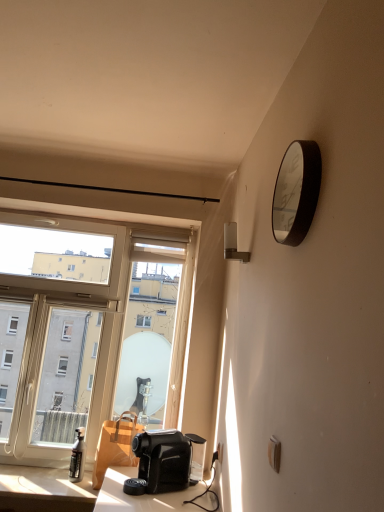
I want to click on free spot in front of matte black spray bottle at lower left, so click(68, 487).